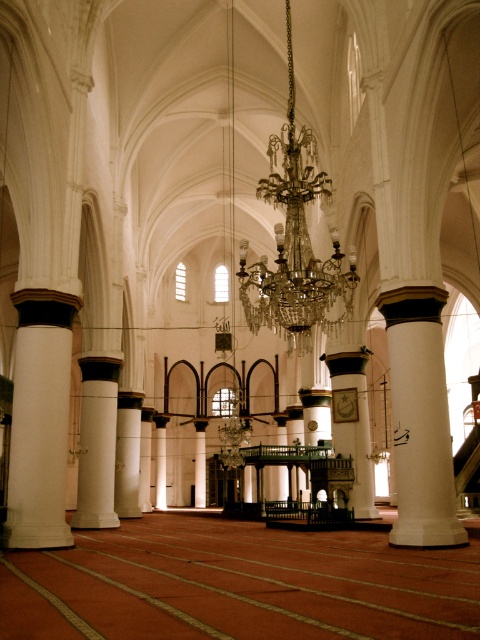
Question: Among these objects, which one is nearest to the camera?

Choices:
 (A) white marble pillar at center
 (B) white marble column at left
 (C) white marble column at center

Answer: (B)

Question: Is white marble column at left wider than white marble column at center?

Choices:
 (A) no
 (B) yes

Answer: (B)

Question: Which of the following is the closest to the observer?

Choices:
 (A) white smooth column at center
 (B) white marble column at center

Answer: (A)

Question: Which of the following is the closest to the observer?

Choices:
 (A) (201, 438)
 (B) (288, 65)

Answer: (B)

Question: Does crystal glass chandelier at center lie in front of white marble pillar at center?

Choices:
 (A) yes
 (B) no

Answer: (A)

Question: Does white smooth column at center have a smaller size compared to white marble column at center?

Choices:
 (A) no
 (B) yes

Answer: (A)